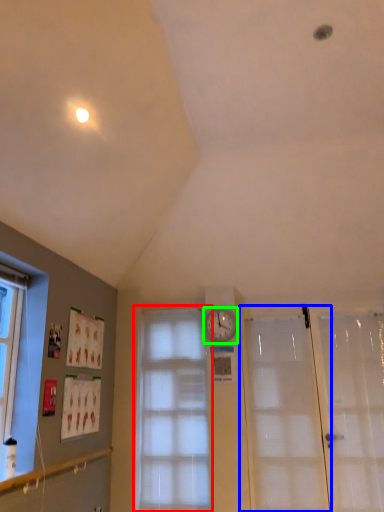
Question: Which object is positioned closest to window (highlighted by a red box)? Select from door (highlighted by a blue box) and clock (highlighted by a green box).

Choices:
 (A) door
 (B) clock

Answer: (B)